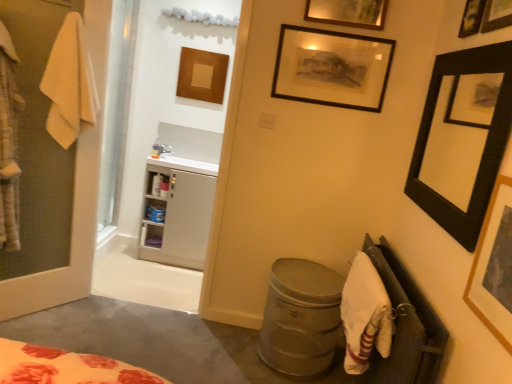
Question: Can you confirm if white glossy sink at upper left is bigger than white fabric at lower right?

Choices:
 (A) no
 (B) yes

Answer: (A)

Question: Does white glossy sink at upper left have a lesser width compared to white fabric at lower right?

Choices:
 (A) yes
 (B) no

Answer: (B)

Question: Can you confirm if white glossy sink at upper left is smaller than white fabric at lower right?

Choices:
 (A) no
 (B) yes

Answer: (B)

Question: Is white glossy sink at upper left aimed at white fabric at lower right?

Choices:
 (A) no
 (B) yes

Answer: (A)

Question: Does white glossy sink at upper left appear on the left side of white fabric at lower right?

Choices:
 (A) no
 (B) yes

Answer: (B)

Question: Is yellow cotton towel at left, positioned as the 1th bath towel in top-to-bottom order, spatially inside black matte picture frame at upper center, acting as the fourth picture frame starting from the front, or outside of it?

Choices:
 (A) inside
 (B) outside

Answer: (B)

Question: Does point (71, 56) appear closer or farther from the camera than point (365, 94)?

Choices:
 (A) closer
 (B) farther

Answer: (A)

Question: From a real-world perspective, is yellow cotton towel at left, the 2th bath towel when ordered from right to left, above or below black matte picture frame at upper center, acting as the fourth picture frame starting from the front?

Choices:
 (A) above
 (B) below

Answer: (B)

Question: Looking at the image, does yellow cotton towel at left, which ranks as the 2th bath towel in bottom-to-top order, seem bigger or smaller compared to black matte picture frame at upper center, arranged as the 2th picture frame when viewed from the left?

Choices:
 (A) big
 (B) small

Answer: (A)

Question: Relative to yellow cotton towel at left, the 1th bath towel positioned from the left, is white cotton bath towel at lower right, which ranks as the second bath towel in left-to-right order, in front or behind?

Choices:
 (A) behind
 (B) front

Answer: (B)

Question: From a real-world perspective, is white cotton bath towel at lower right, placed as the 1th bath towel when sorted from right to left, physically located above or below yellow cotton towel at left, the 1th bath towel positioned from the left?

Choices:
 (A) below
 (B) above

Answer: (A)

Question: Is white cotton bath towel at lower right, which is counted as the second bath towel, starting from the top, taller or shorter than yellow cotton towel at left, positioned as the 1th bath towel in top-to-bottom order?

Choices:
 (A) short
 (B) tall

Answer: (A)

Question: Considering the relative positions of white cotton bath towel at lower right, which ranks as the second bath towel in left-to-right order, and yellow cotton towel at left, the 1th bath towel positioned from the left, in the image provided, is white cotton bath towel at lower right, which ranks as the second bath towel in left-to-right order, to the left or to the right of yellow cotton towel at left, the 1th bath towel positioned from the left,?

Choices:
 (A) right
 (B) left

Answer: (A)

Question: Considering the positions of wooden framed picture at upper right, the fourth picture frame from the back, and white cotton bath towel at lower right, which is counted as the second bath towel, starting from the top, in the image, is wooden framed picture at upper right, the fourth picture frame from the back, wider or thinner than white cotton bath towel at lower right, which is counted as the second bath towel, starting from the top,?

Choices:
 (A) thin
 (B) wide

Answer: (A)

Question: Is point click(464, 21) positioned closer to the camera than point click(376, 288)?

Choices:
 (A) closer
 (B) farther

Answer: (B)